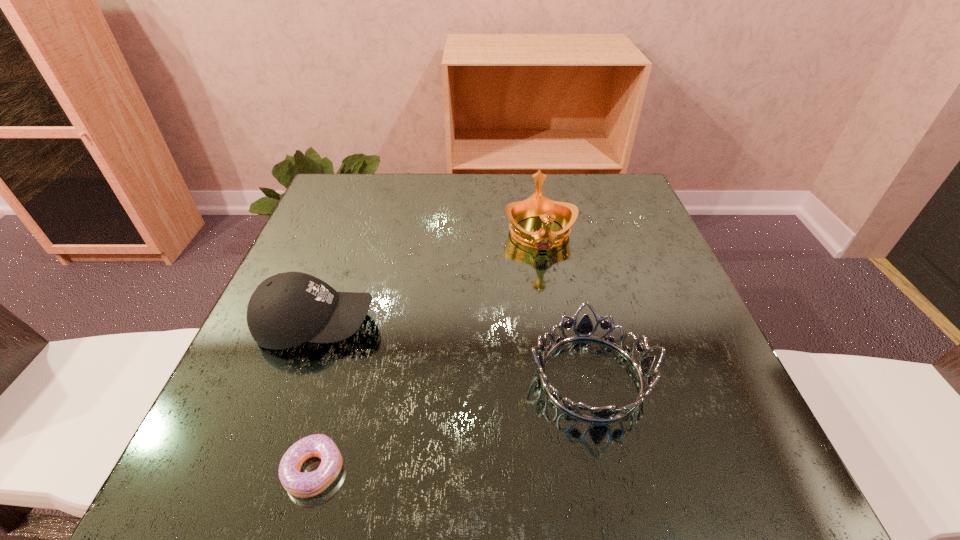
What are the coordinates of `vacant space located on the front-facing side of the shorter tiara` in the screenshot? It's located at (463, 376).

At what (x,y) coordinates should I click in order to perform the action: click on blank space located 0.120m on the front-facing side of the shorter tiara. Please return your answer as a coordinate pair (x, y). Looking at the image, I should click on (456, 376).

Locate an element on the screen. The width and height of the screenshot is (960, 540). vacant space located 0.210m on the back of the shortest object is located at coordinates (352, 334).

Where is `object that is positioned at the far edge`? The height and width of the screenshot is (540, 960). object that is positioned at the far edge is located at coordinates (565, 214).

The width and height of the screenshot is (960, 540). I want to click on object that is positioned at the near edge, so click(x=303, y=485).

You are a GUI agent. You are given a task and a screenshot of the screen. Output one action in this format:
    pyautogui.click(x=<x>, y=<y>)
    Task: Click on the baseball cap at the left edge
    The width and height of the screenshot is (960, 540).
    Given the screenshot: What is the action you would take?
    pyautogui.click(x=287, y=309)

Locate an element on the screen. doughnut located at the left edge is located at coordinates (303, 485).

Image resolution: width=960 pixels, height=540 pixels. In order to click on object that is at the right edge in this screenshot , I will do click(x=584, y=329).

Image resolution: width=960 pixels, height=540 pixels. In order to click on object that is at the near left corner in this screenshot , I will do `click(303, 485)`.

Image resolution: width=960 pixels, height=540 pixels. In order to click on free space at the far edge of the desktop in this screenshot , I will do `click(448, 177)`.